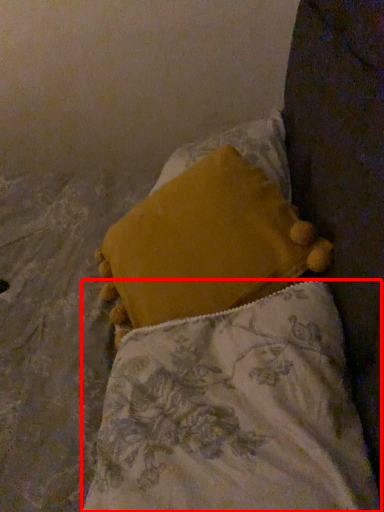
Question: In this image, where is pillow (annotated by the red box) located relative to pillow?

Choices:
 (A) left
 (B) right

Answer: (A)